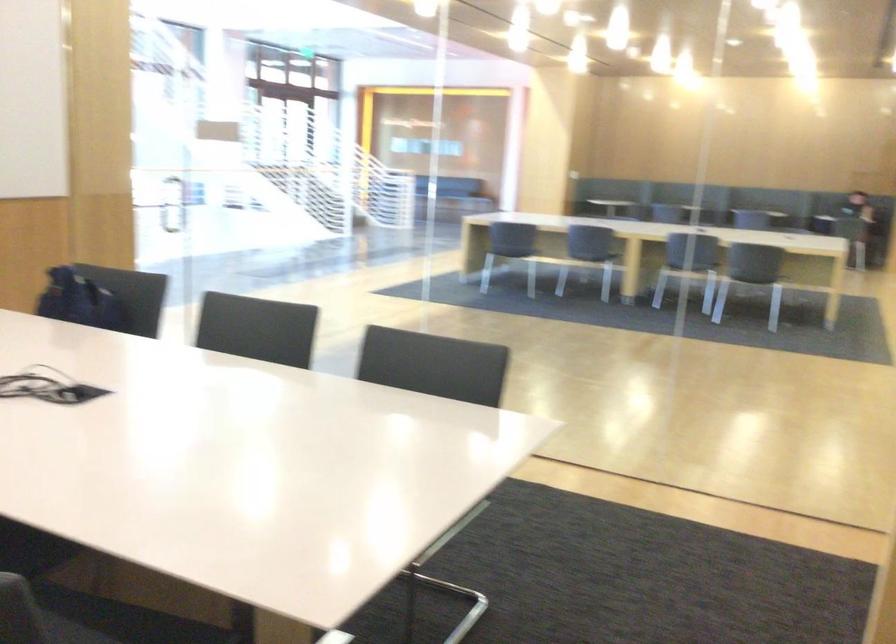
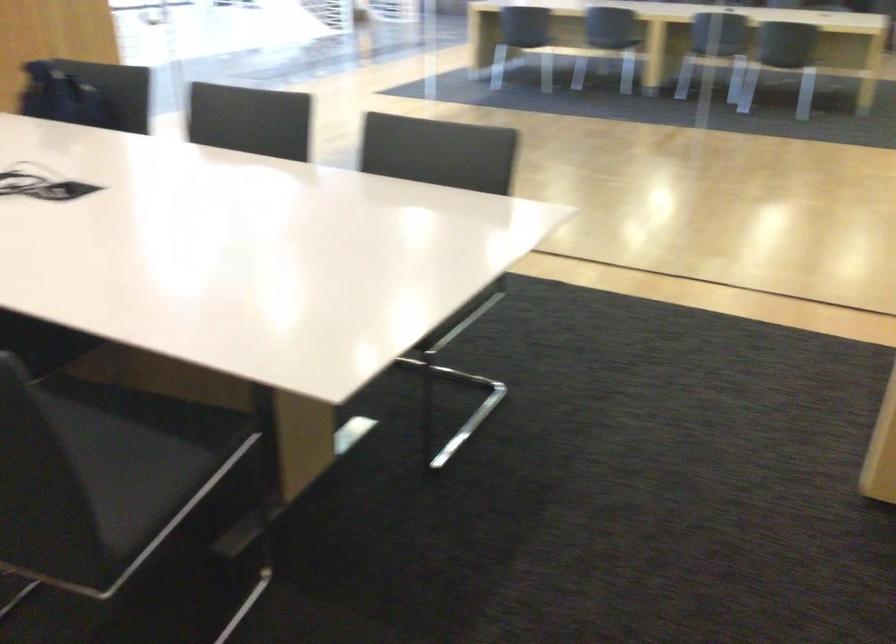
Question: The images are taken continuously from a first-person perspective. In which direction is your viewpoint rotating?

Choices:
 (A) Left
 (B) Right
 (C) Up
 (D) Down

Answer: (D)